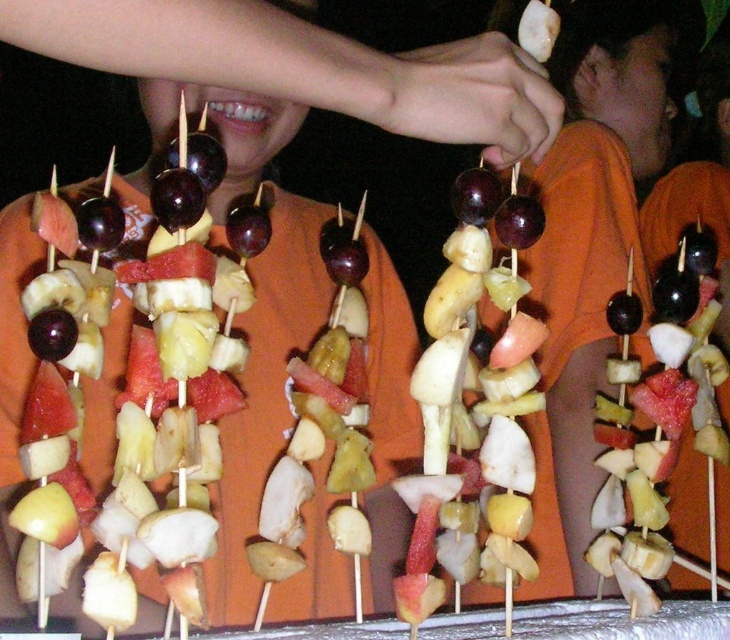
Question: Among these objects, which one is farthest from the camera?

Choices:
 (A) shiny red watermelon at center
 (B) glossy wooden skewer with assorted fruits at center

Answer: (A)

Question: Does orange cotton shirt at center lie behind shiny red watermelon at center?

Choices:
 (A) no
 (B) yes

Answer: (B)

Question: Does orange cotton shirt at center have a greater width compared to glossy wooden skewer with assorted fruits at center?

Choices:
 (A) yes
 (B) no

Answer: (A)

Question: Which point is closer to the camera taking this photo?

Choices:
 (A) [x=512, y=168]
 (B) [x=591, y=492]

Answer: (A)

Question: Which object appears farthest from the camera in this image?

Choices:
 (A) glossy wooden skewer with assorted fruits at center
 (B) shiny red watermelon at center
 (C) orange cotton shirt at center

Answer: (C)

Question: Does orange cotton shirt at center have a smaller size compared to glossy wooden skewer with assorted fruits at center?

Choices:
 (A) yes
 (B) no

Answer: (B)